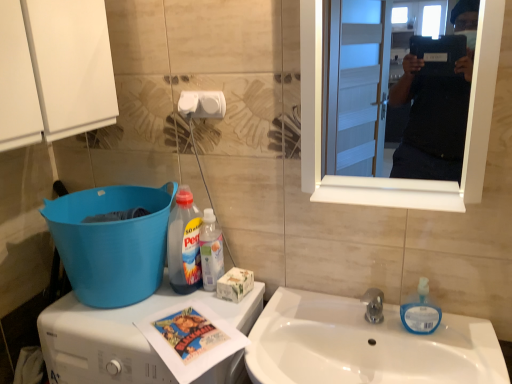
Question: Can you confirm if white glossy mirror at upper right is wider than translucent plastic bottle at center, acting as the 1th bottle starting from the right?

Choices:
 (A) no
 (B) yes

Answer: (B)

Question: Is white glossy mirror at upper right closer to the viewer compared to translucent plastic bottle at center, acting as the 1th bottle starting from the right?

Choices:
 (A) no
 (B) yes

Answer: (B)

Question: Is white glossy mirror at upper right thinner than translucent plastic bottle at center, which appears as the 2th bottle when viewed from the left?

Choices:
 (A) yes
 (B) no

Answer: (B)

Question: From the image's perspective, is white glossy mirror at upper right below translucent plastic bottle at center, acting as the 1th bottle starting from the right?

Choices:
 (A) yes
 (B) no

Answer: (B)

Question: Can you confirm if white glossy mirror at upper right is positioned to the right of translucent plastic bottle at center, which appears as the 2th bottle when viewed from the left?

Choices:
 (A) yes
 (B) no

Answer: (A)

Question: Considering the positions of blue translucent soap dispenser at sink right and white glossy cabinet at upper left in the image, is blue translucent soap dispenser at sink right wider or thinner than white glossy cabinet at upper left?

Choices:
 (A) thin
 (B) wide

Answer: (A)

Question: Based on their positions, is blue translucent soap dispenser at sink right located to the left or right of white glossy cabinet at upper left?

Choices:
 (A) right
 (B) left

Answer: (A)

Question: Is blue translucent soap dispenser at sink right in front of or behind white glossy cabinet at upper left in the image?

Choices:
 (A) front
 (B) behind

Answer: (B)

Question: Which is correct: blue translucent soap dispenser at sink right is inside white glossy cabinet at upper left, or outside of it?

Choices:
 (A) outside
 (B) inside

Answer: (A)

Question: In terms of width, does blue translucent soap dispenser at sink right look wider or thinner when compared to translucent plastic detergent at lower left, positioned as the first bottle in left-to-right order?

Choices:
 (A) thin
 (B) wide

Answer: (A)

Question: Considering the positions of blue translucent soap dispenser at sink right and translucent plastic detergent at lower left, placed as the 2th bottle when sorted from right to left, in the image, is blue translucent soap dispenser at sink right taller or shorter than translucent plastic detergent at lower left, placed as the 2th bottle when sorted from right to left,?

Choices:
 (A) tall
 (B) short

Answer: (B)

Question: Which is correct: blue translucent soap dispenser at sink right is inside translucent plastic detergent at lower left, positioned as the first bottle in left-to-right order, or outside of it?

Choices:
 (A) outside
 (B) inside

Answer: (A)

Question: Does point pyautogui.click(x=431, y=326) appear closer or farther from the camera than point pyautogui.click(x=176, y=193)?

Choices:
 (A) closer
 (B) farther

Answer: (A)

Question: Considering the positions of point (209, 271) and point (242, 360), is point (209, 271) closer or farther from the camera than point (242, 360)?

Choices:
 (A) closer
 (B) farther

Answer: (B)

Question: In the image, is translucent plastic bottle at center, which appears as the 2th bottle when viewed from the left, positioned in front of or behind white plastic washing machine at lower left?

Choices:
 (A) behind
 (B) front

Answer: (A)